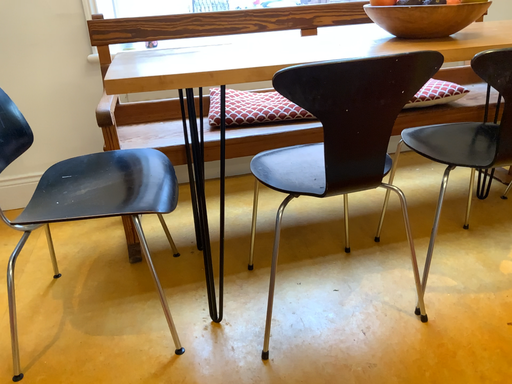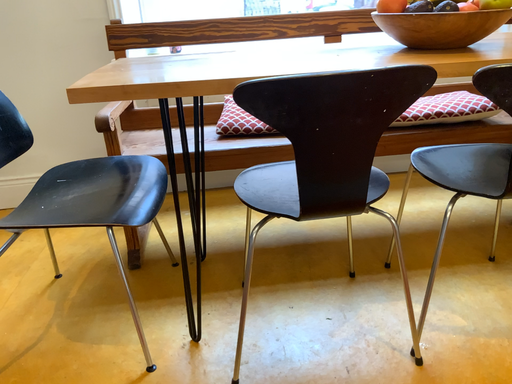
Question: Which way did the camera rotate in the video?

Choices:
 (A) rotated right
 (B) rotated left

Answer: (B)